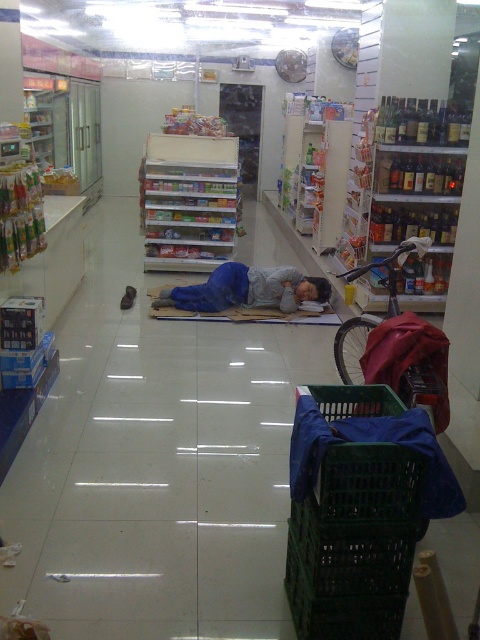
You are a delivery person who needs to navigate through the store to reach the back office. There are two points marked in the scene. Which point, point (403, 244) or point (240, 292), is closer to you as you enter the store?

Point (403, 244) is closer to the camera than point (240, 292), so it is closer to you as you enter the store.

You are a delivery person entering the store and see the green plastic crate at lower right. You need to place a package on it. Can you reach the crate from where you are standing?

The green plastic crate at lower right is 1.83 meters from viewer. Since the average person can reach about 2 meters, you can reach the crate from where you are standing.

From the picture: You are a delivery person who needs to move a large package from the entrance to the storage area in the back. The path goes through the aisle where the green plastic crate at lower right and the blue fabric sleeping bag at center are located. Can you navigate around them without moving the objects?

The green plastic crate at lower right is 3.33 meters away from the blue fabric sleeping bag at center, so there is sufficient space between them to navigate around without moving the objects.